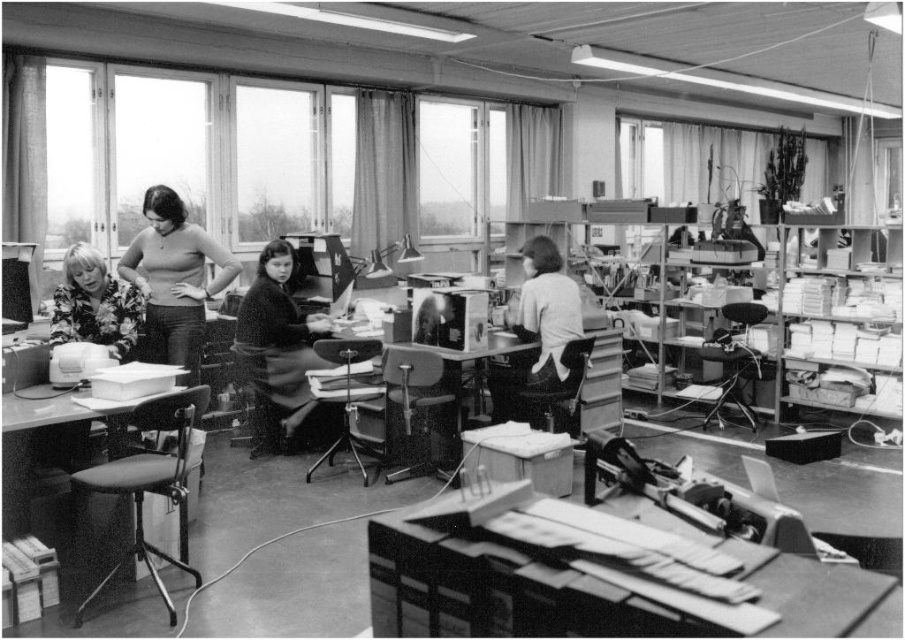
Question: Is dark fabric coat at center behind matte black sweater at center?

Choices:
 (A) no
 (B) yes

Answer: (B)

Question: Which of the following is the farthest from the observer?

Choices:
 (A) dark fabric coat at center
 (B) floral fabric blouse at left

Answer: (A)

Question: Can you confirm if matte black sweater at center is positioned to the left of floral fabric blouse at left?

Choices:
 (A) no
 (B) yes

Answer: (A)

Question: In this image, where is dark fabric coat at center located relative to light gray fabric shirt at center?

Choices:
 (A) left
 (B) right

Answer: (A)

Question: Which point is closer to the camera taking this photo?

Choices:
 (A) (97, 333)
 (B) (536, 304)
 (C) (183, 257)

Answer: (A)

Question: Which is nearer to the floral fabric blouse at left?

Choices:
 (A) dark fabric coat at center
 (B) light gray fabric shirt at center
 (C) matte black sweater at center

Answer: (C)